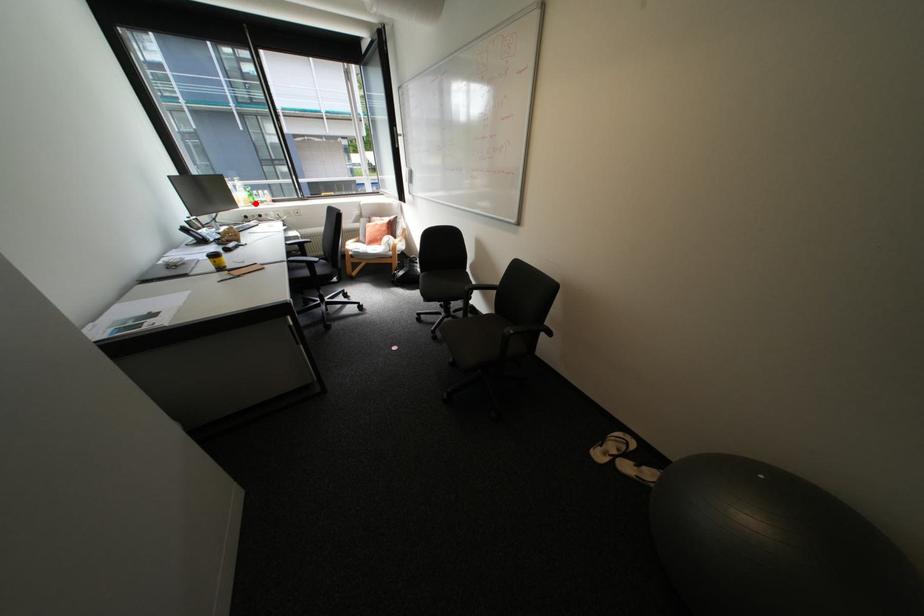
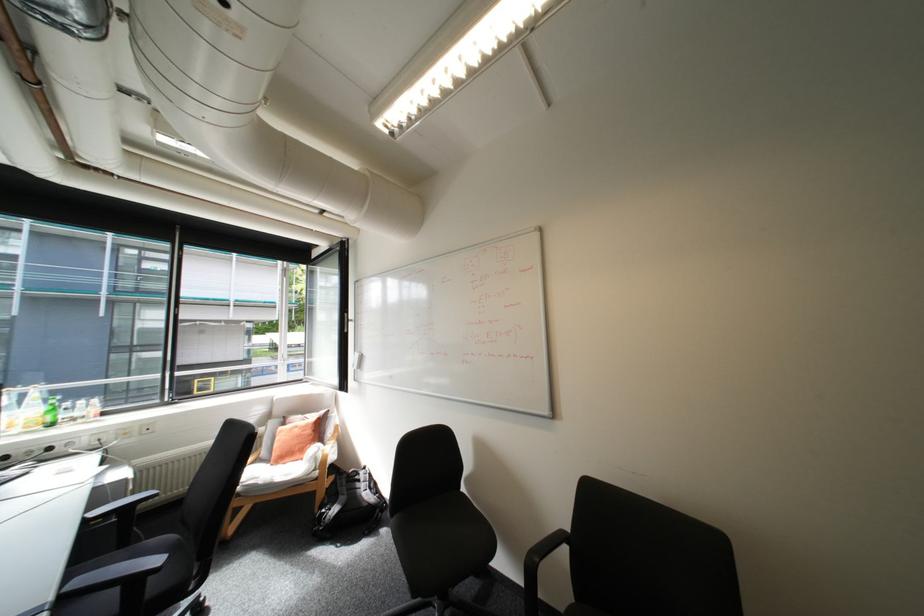
In the second image, find the point that corresponds to the highlighted location in the first image.

(38, 427)